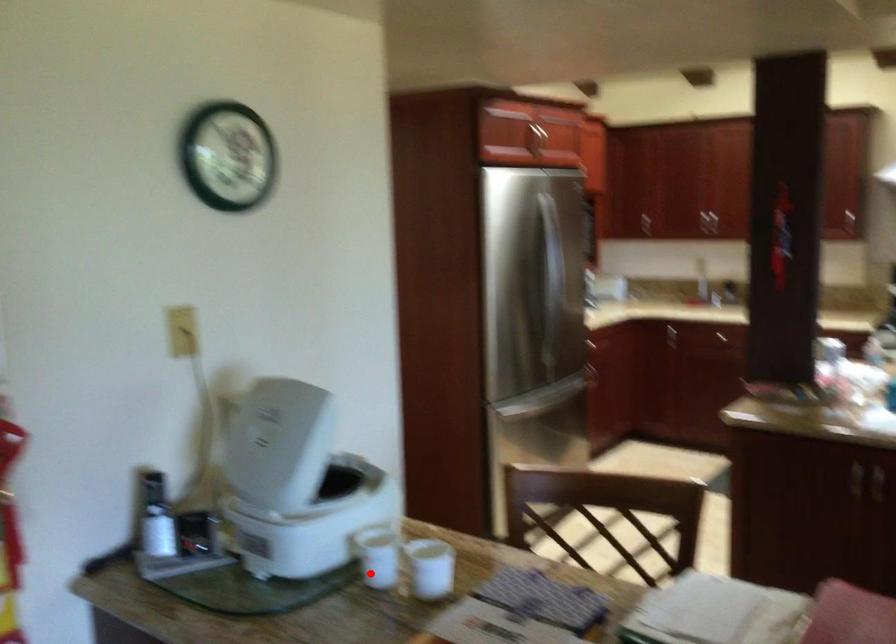
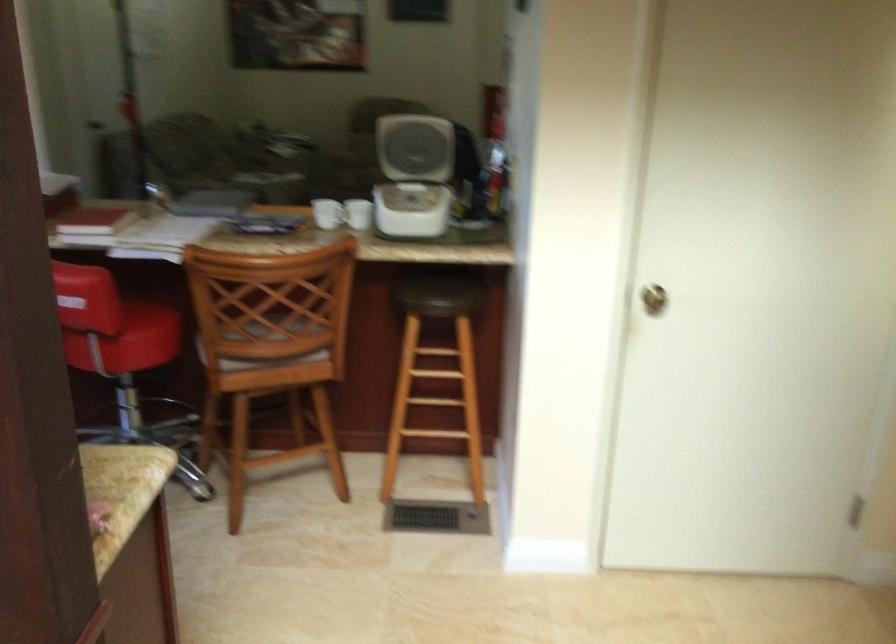
Question: I am providing you with two images of the same scene from different viewpoints. A red point is shown in image1. For the corresponding object point in image2, is it positioned nearer or farther from the camera?

Choices:
 (A) Nearer
 (B) Farther

Answer: (B)